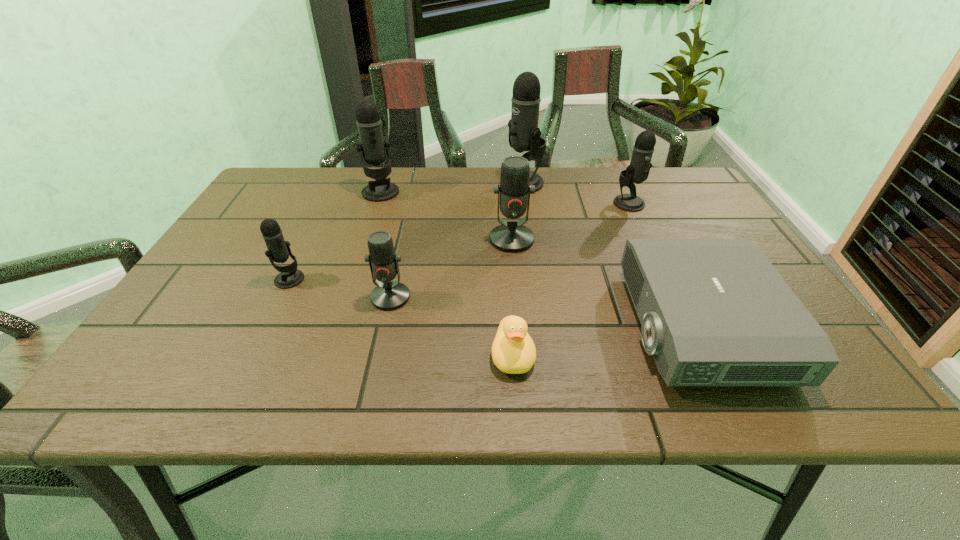
Locate an element on the screen. The height and width of the screenshot is (540, 960). free space located 0.090m on the front-facing side of the projector is located at coordinates (588, 325).

The height and width of the screenshot is (540, 960). What are the coordinates of `vacant region located on the front-facing side of the projector` in the screenshot? It's located at (530, 325).

Identify the location of vacant area situated on the front-facing side of the projector. This screenshot has height=540, width=960. 443,325.

Where is `projector at the near edge`? This screenshot has width=960, height=540. projector at the near edge is located at coordinates (714, 312).

I want to click on duck located at the near edge, so click(513, 351).

Find the location of a particular element. This screenshot has height=540, width=960. object that is positioned at the right edge is located at coordinates (714, 312).

You are a GUI agent. You are given a task and a screenshot of the screen. Output one action in this format:
    pyautogui.click(x=<x>, y=<y>)
    Task: Click on the object that is at the near right corner
    The height and width of the screenshot is (540, 960).
    Given the screenshot: What is the action you would take?
    pyautogui.click(x=714, y=312)

In the image, there is a desktop. Identify the location of vacant space at the far edge. (552, 206).

At what (x,y) coordinates should I click in order to perform the action: click on vacant space at the near edge of the desktop. Please return your answer as a coordinate pair (x, y). Image resolution: width=960 pixels, height=540 pixels. Looking at the image, I should click on (644, 371).

What are the coordinates of `free spot at the left edge of the desktop` in the screenshot? It's located at (249, 213).